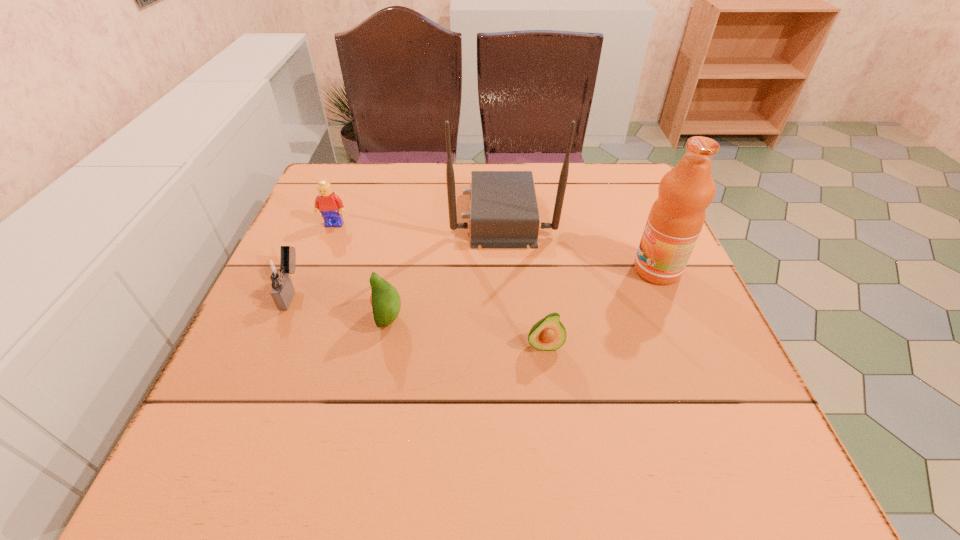
Locate an element on the screen. free space between the shortest object and the igniter is located at coordinates (419, 318).

The width and height of the screenshot is (960, 540). What are the coordinates of `unoccupied position between the router and the igniter` in the screenshot? It's located at (397, 253).

Where is `empty location between the farther avocado and the igniter`? Image resolution: width=960 pixels, height=540 pixels. empty location between the farther avocado and the igniter is located at coordinates (341, 305).

This screenshot has width=960, height=540. In order to click on free space between the igniter and the nearest object in this screenshot , I will do `click(419, 318)`.

Where is `vacant area that lies between the taller avocado and the igniter`? This screenshot has width=960, height=540. vacant area that lies between the taller avocado and the igniter is located at coordinates tap(341, 305).

This screenshot has height=540, width=960. What are the coordinates of `empty space that is in between the Lego and the farther avocado` in the screenshot? It's located at tap(362, 271).

At what (x,y) coordinates should I click in order to perform the action: click on vacant area that lies between the Lego and the router. Please return your answer as a coordinate pair (x, y). This screenshot has height=540, width=960. Looking at the image, I should click on (419, 219).

Find the location of a particular element. free space between the router and the third object from left to right is located at coordinates (446, 267).

The image size is (960, 540). Identify the location of free space that is in between the farther avocado and the Lego. (362, 271).

Identify the location of object that can be found as the closest to the router. (676, 218).